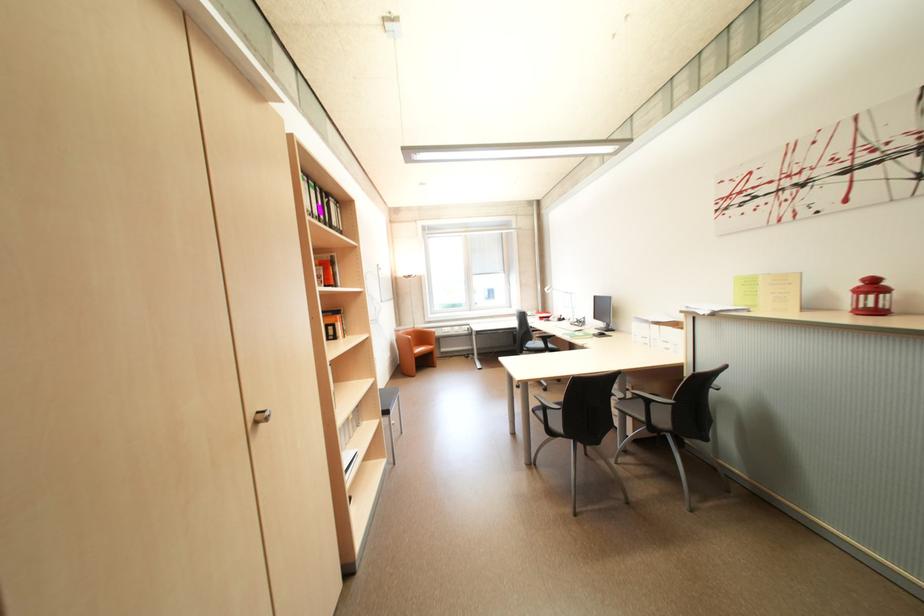
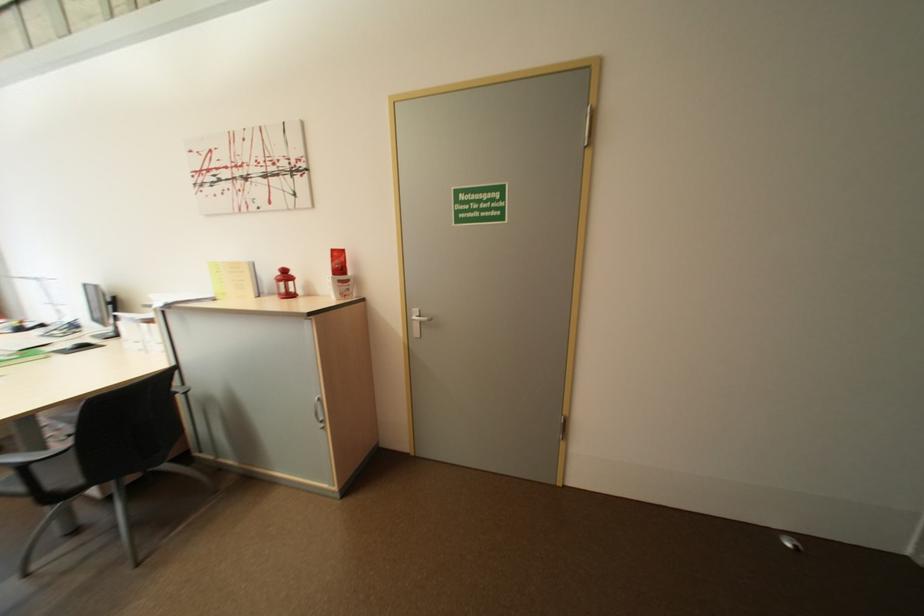
In the second image, find the point that corresponds to [762,306] in the first image.

(234, 294)